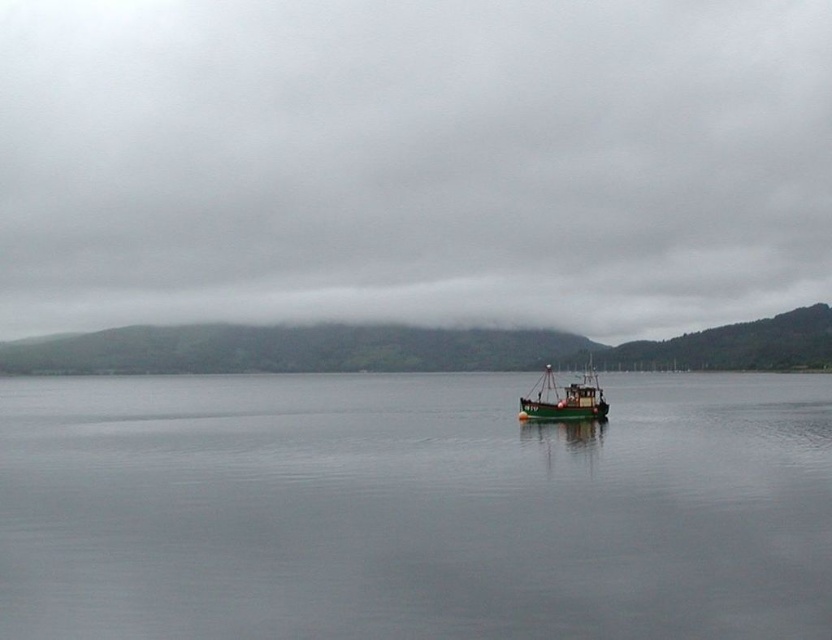
Question: Which object is farther from the camera taking this photo?

Choices:
 (A) green matte water at center
 (B) cloudy sky at center
 (C) green matte boat at center

Answer: (B)

Question: Does cloudy sky at center appear over green matte boat at center?

Choices:
 (A) no
 (B) yes

Answer: (B)

Question: Can you confirm if cloudy sky at center is thinner than green matte boat at center?

Choices:
 (A) yes
 (B) no

Answer: (B)

Question: Based on their relative distances, which object is nearer to the green matte water at center?

Choices:
 (A) green matte boat at center
 (B) cloudy sky at center

Answer: (A)

Question: Based on their relative distances, which object is farther from the green matte water at center?

Choices:
 (A) green matte boat at center
 (B) cloudy sky at center

Answer: (B)

Question: Can you confirm if cloudy sky at center is positioned above green matte water at center?

Choices:
 (A) no
 (B) yes

Answer: (B)